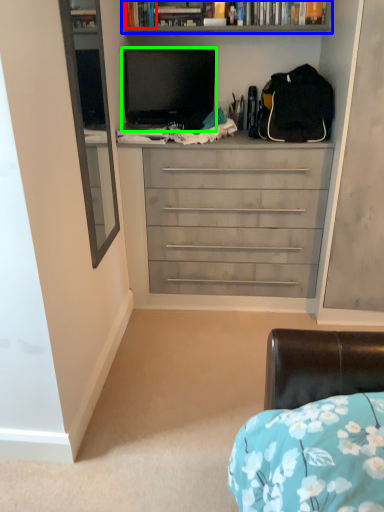
Question: Estimate the real-world distances between objects in this image. Which object is farther from book (highlighted by a red box), bookcase (highlighted by a blue box) or television (highlighted by a green box)?

Choices:
 (A) bookcase
 (B) television

Answer: (B)